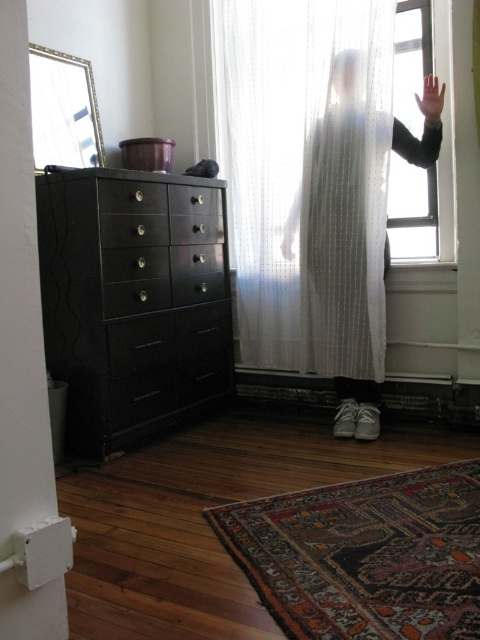
You are standing in the room and want to place a small plant between the two points, point (320, 320) and point (284, 234). Which point should the plant be closer to if you want it to be nearer to the window?

Point (320, 320) is closer to the viewer than point (284, 234). Since the window is on the right side of the frame, placing the plant closer to point (320, 320) would position it nearer to the window.

You are standing in the room and want to know which object is taller between the white sheer curtain at center and the translucent white hand at upper right. Can you determine this based on their positions?

The white sheer curtain at center is taller than the translucent white hand at upper right according to their positions.

You are organizing a small party and need to place a 1.2 meter long tablecloth on either the matte black dresser at left or the white sheer dress at center. Based on their widths, which object can accommodate the tablecloth without folding it?

The matte black dresser at left has a greater width than the white sheer dress at center, so the tablecloth can be placed on the matte black dresser at left without folding.